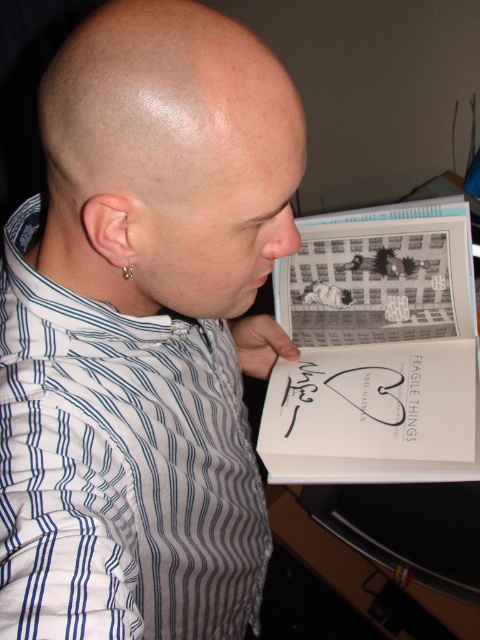
Question: Which point is farther to the camera?

Choices:
 (A) silver metallic earring at ear
 (B) white striped shirt at center
 (C) bald head at center

Answer: (A)

Question: Which is nearer to the white striped shirt at center?

Choices:
 (A) silver metallic earring at ear
 (B) bald head at center

Answer: (B)

Question: Observing the image, what is the correct spatial positioning of bald head at center in reference to silver metallic earring at ear?

Choices:
 (A) above
 (B) below

Answer: (A)

Question: Which of the following is the farthest from the observer?

Choices:
 (A) white striped shirt at center
 (B) bald head at center
 (C) silver metallic earring at ear

Answer: (C)

Question: Observing the image, what is the correct spatial positioning of bald head at center in reference to silver metallic earring at ear?

Choices:
 (A) right
 (B) left

Answer: (A)

Question: Is white striped shirt at center positioned in front of silver metallic earring at ear?

Choices:
 (A) yes
 (B) no

Answer: (A)